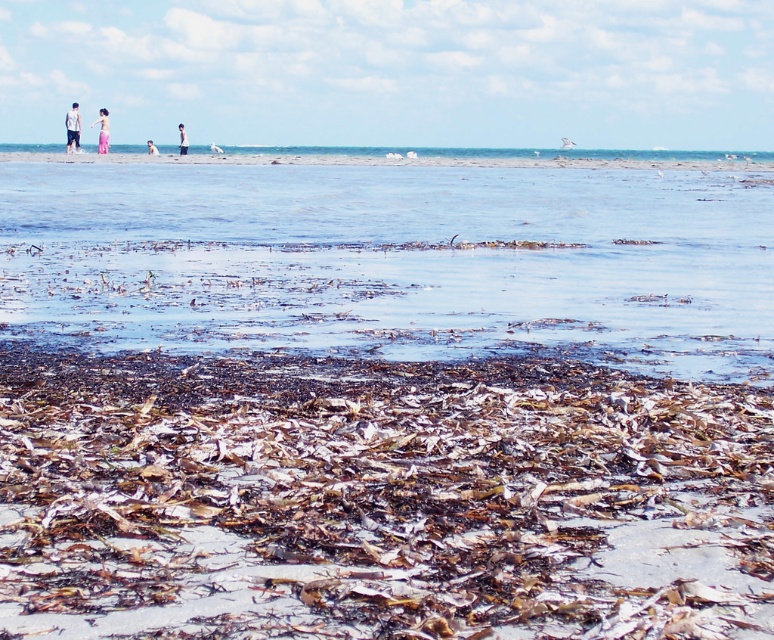
Question: From the image, what is the correct spatial relationship of pink fabric dress at upper left in relation to pink fabric at upper left?

Choices:
 (A) above
 (B) below

Answer: (B)

Question: Does light blue denim shorts at left appear on the right side of light blue cotton shirt at center?

Choices:
 (A) yes
 (B) no

Answer: (B)

Question: Does light blue denim shorts at left appear over light blue cotton shirt at center?

Choices:
 (A) no
 (B) yes

Answer: (A)

Question: Which of the following is the farthest from the observer?

Choices:
 (A) (74, 113)
 (B) (185, 132)
 (C) (156, 148)
 (D) (12, 250)

Answer: (B)

Question: Which object is the farthest from the light blue cotton shirt at center?

Choices:
 (A) pink fabric at upper left
 (B) light blue denim shorts at left
 (C) pink fabric dress at upper left
 (D) brown/textured seaweed at center

Answer: (D)

Question: Which object is closer to the camera taking this photo?

Choices:
 (A) pink fabric at upper left
 (B) pink fabric dress at upper left

Answer: (B)